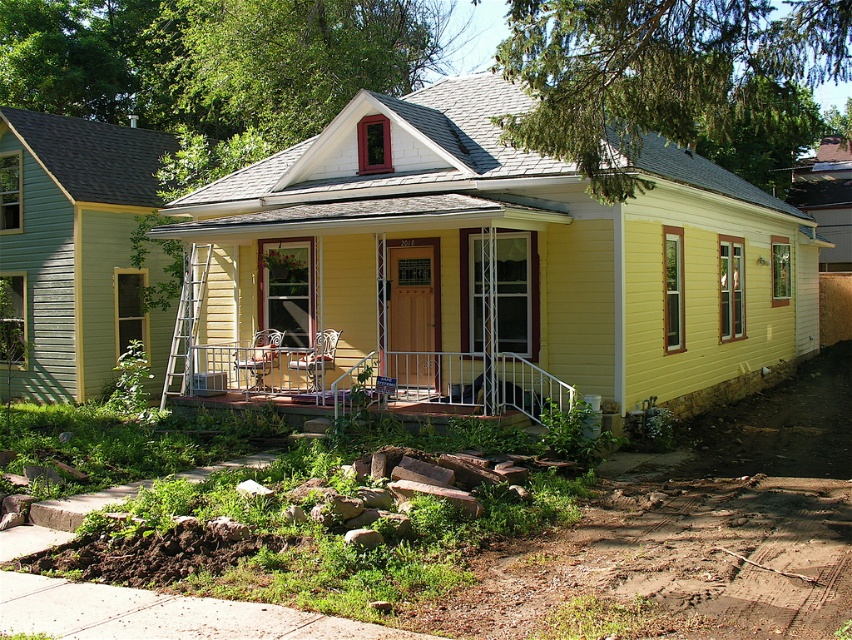
You are a delivery person trying to park your delivery van in front of the house. The van needs to be parked between the metallic white railing at center and the metallic silver rocking chair at center. Can you fit the van there?

The metallic white railing at center occupies less space than the metallic silver rocking chair at center, so there is enough space between them to park the delivery van.

You are standing in front of the house and want to move from the metallic white railing at center to the metallic silver rocking chair at center. Which direction should you move to reach the chair?

The metallic white railing at center is positioned on the right side of the metallic silver rocking chair at center. To reach the chair, you should move to the left.